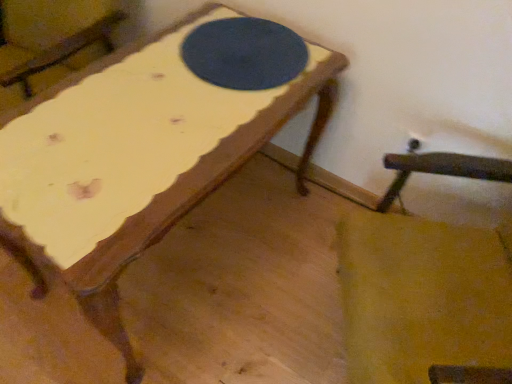
You are a GUI agent. You are given a task and a screenshot of the screen. Output one action in this format:
    pyautogui.click(x=<x>, y=<y>)
    Task: Click on the free point above dark blue felt table tennis table at center (from a real-world perspective)
    The width and height of the screenshot is (512, 384).
    Given the screenshot: What is the action you would take?
    pyautogui.click(x=241, y=49)